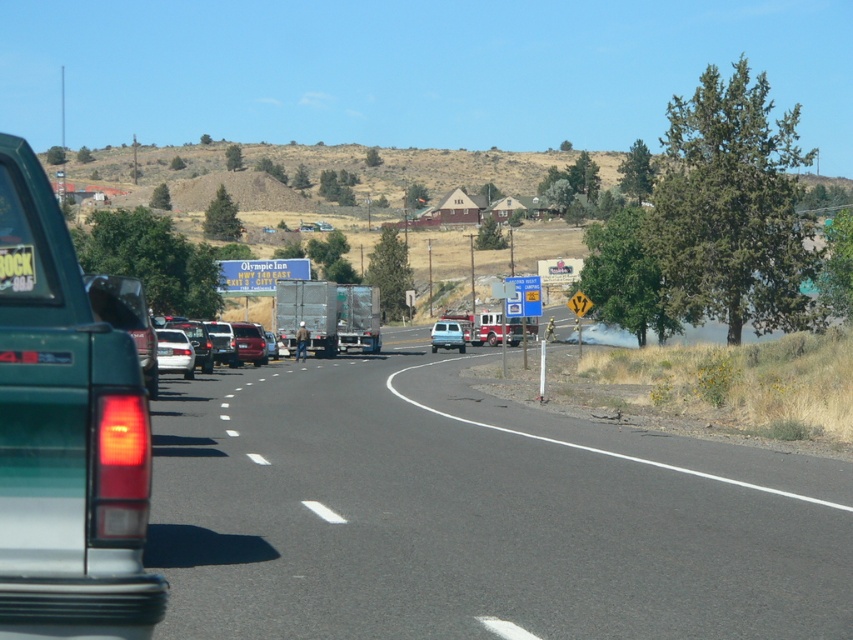
Question: Which point is farther to the camera?

Choices:
 (A) (170, 362)
 (B) (463, 349)
 (C) (167, 352)
 (D) (233, 353)

Answer: (B)

Question: Observing the image, what is the correct spatial positioning of green matte truck at left in reference to white matte sedan at center?

Choices:
 (A) below
 (B) above

Answer: (B)

Question: Which object is positioned farthest from the white plastic license plate at center?

Choices:
 (A) white matte van at center
 (B) white matte sedan at center

Answer: (A)

Question: Considering the relative positions of metallic maroon sedan at center and white matte van at center in the image provided, where is metallic maroon sedan at center located with respect to white matte van at center?

Choices:
 (A) above
 (B) below

Answer: (A)

Question: Which point is closer to the camera taking this photo?

Choices:
 (A) (167, 349)
 (B) (247, 349)
 (C) (477, 358)
 (D) (231, 353)

Answer: (A)

Question: Is metallic maroon sedan at center thinner than white plastic license plate at center?

Choices:
 (A) no
 (B) yes

Answer: (A)